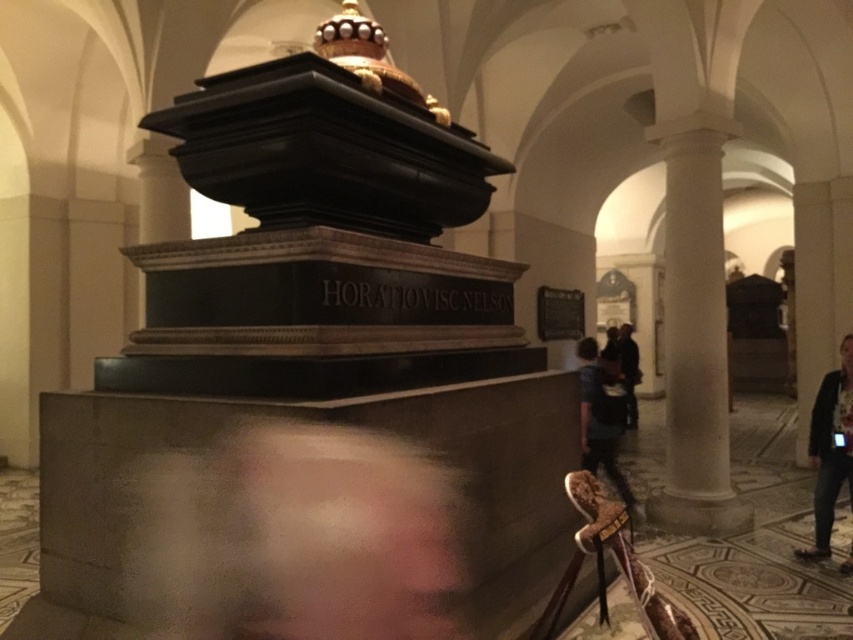
Does jeans at lower right lie in front of black leather jacket at right?

Yes, jeans at lower right is in front of black leather jacket at right.

Which is more to the left, jeans at lower right or black leather jacket at right?

jeans at lower right is more to the left.

The image size is (853, 640). What do you see at coordinates (830, 449) in the screenshot?
I see `jeans at lower right` at bounding box center [830, 449].

Image resolution: width=853 pixels, height=640 pixels. I want to click on jeans at lower right, so click(x=830, y=449).

How distant is dark blue jeans at center from black leather jacket at right?

dark blue jeans at center is 4.34 meters from black leather jacket at right.

Consider the image. Between dark blue jeans at center and black leather jacket at right, which one is positioned lower?

dark blue jeans at center is lower down.

What are the coordinates of `dark blue jeans at center` in the screenshot? It's located at (601, 416).

At what (x,y) coordinates should I click in order to perform the action: click on dark blue jeans at center. Please return your answer as a coordinate pair (x, y). The width and height of the screenshot is (853, 640). Looking at the image, I should click on (601, 416).

In the scene shown: Can you confirm if jeans at lower right is bigger than dark blue jeans at center?

Actually, jeans at lower right might be smaller than dark blue jeans at center.

Is point (828, 444) less distant than point (589, 472)?

Yes.

Describe the element at coordinates (830, 449) in the screenshot. This screenshot has width=853, height=640. I see `jeans at lower right` at that location.

This screenshot has height=640, width=853. Find the location of `jeans at lower right`. jeans at lower right is located at coordinates (830, 449).